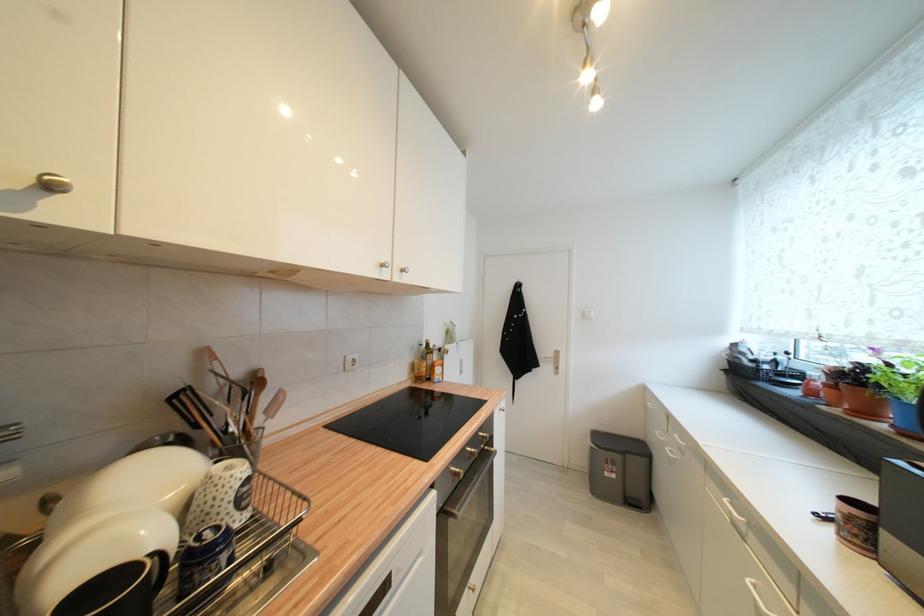
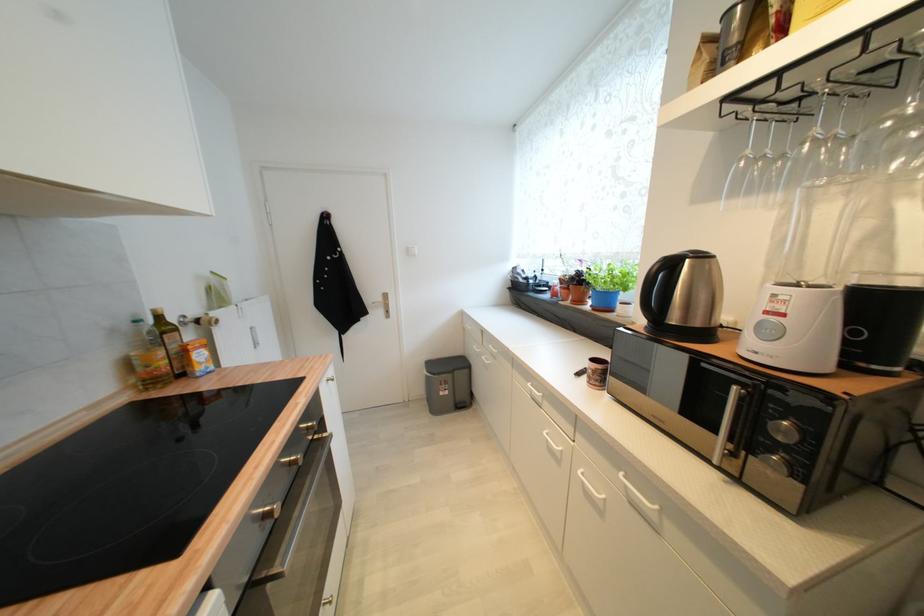
Question: Based on the continuous images, in which direction is the camera rotating? Reply with the corresponding letter.

Choices:
 (A) Left
 (B) Right
 (C) Up
 (D) Down

Answer: (B)